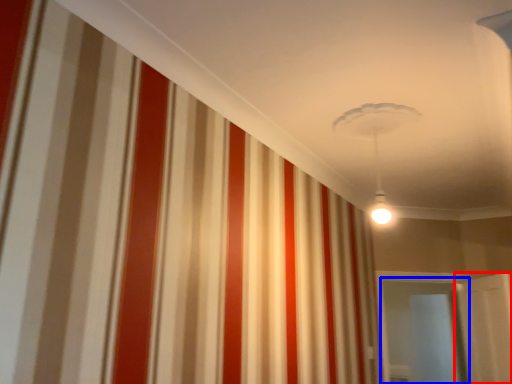
Question: Which point is closer to the camera, door (highlighted by a red box) or glass door (highlighted by a blue box)?

Choices:
 (A) door
 (B) glass door

Answer: (A)